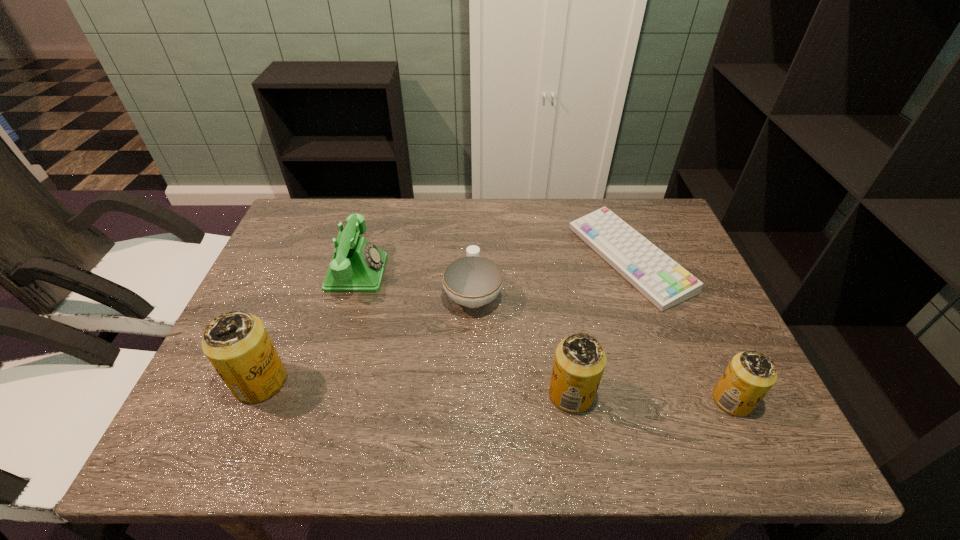
To make them evenly spaced by inserting another beer_can among them, please locate a free space for this new beer_can. Please provide its 2D coordinates. Your answer should be formatted as a tuple, i.e. [(x, y)], where the tuple contains the x and y coordinates of a point satisfying the conditions above.

[(414, 388)]